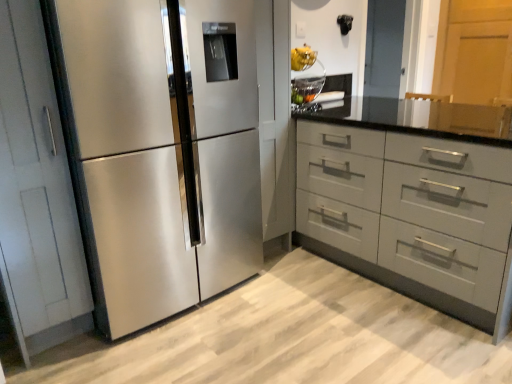
The image size is (512, 384). Describe the element at coordinates (164, 150) in the screenshot. I see `stainless steel refrigerator at left` at that location.

The width and height of the screenshot is (512, 384). Identify the location of stainless steel refrigerator at left. (164, 150).

Measure the distance between matte gray drawers at center-right and camera.

5.29 feet.

What is the approximate width of matte gray drawers at center-right?

91.04 centimeters.

Locate an element on the screen. This screenshot has width=512, height=384. matte gray drawers at center-right is located at coordinates (409, 213).

Describe the element at coordinates (409, 213) in the screenshot. I see `matte gray drawers at center-right` at that location.

Find the location of a particular element. stainless steel refrigerator at left is located at coordinates (164, 150).

Between matte gray drawers at center-right and stainless steel refrigerator at left, which one appears on the left side from the viewer's perspective?

Positioned to the left is stainless steel refrigerator at left.

Looking at this image, does matte gray drawers at center-right lie in front of stainless steel refrigerator at left?

No, it is not.

Is point (461, 248) positioned in front of point (256, 91)?

Yes, it is.

From the image's perspective, is matte gray drawers at center-right located above or below stainless steel refrigerator at left?

matte gray drawers at center-right is situated lower than stainless steel refrigerator at left in the image.

From a real-world perspective, is matte gray drawers at center-right physically above stainless steel refrigerator at left?

No, from a real-world perspective, matte gray drawers at center-right is not above stainless steel refrigerator at left.

Consider the image. Looking at their sizes, would you say matte gray drawers at center-right is wider or thinner than stainless steel refrigerator at left?

In the image, matte gray drawers at center-right appears to be wider than stainless steel refrigerator at left.

Which of these two, matte gray drawers at center-right or stainless steel refrigerator at left, stands shorter?

matte gray drawers at center-right.

Does matte gray drawers at center-right have a larger size compared to stainless steel refrigerator at left?

Correct, matte gray drawers at center-right is larger in size than stainless steel refrigerator at left.

Based on the photo, choose the correct answer: Is matte gray drawers at center-right inside stainless steel refrigerator at left or outside it?

The correct answer is: outside.

Are matte gray drawers at center-right and stainless steel refrigerator at left making contact?

No, matte gray drawers at center-right is not touching stainless steel refrigerator at left.

Is matte gray drawers at center-right looking in the opposite direction of stainless steel refrigerator at left?

That's not correct — matte gray drawers at center-right is not looking away from stainless steel refrigerator at left.

Find the location of a particular element. Image resolution: width=512 pixels, height=384 pixels. the chest of drawers below the stainless steel refrigerator at left (from the image's perspective) is located at coordinates (409, 213).

Is stainless steel refrigerator at left at the left side of matte gray drawers at center-right?

Indeed, stainless steel refrigerator at left is positioned on the left side of matte gray drawers at center-right.

Is stainless steel refrigerator at left further to the viewer compared to matte gray drawers at center-right?

No, stainless steel refrigerator at left is closer to the viewer.

Which is closer, (146,232) or (378,203)?

The point (146,232) is in front.

From the image's perspective, is stainless steel refrigerator at left positioned above or below matte gray drawers at center-right?

Clearly, from the image's perspective, stainless steel refrigerator at left is above matte gray drawers at center-right.

From a real-world perspective, is stainless steel refrigerator at left positioned above or below matte gray drawers at center-right?

stainless steel refrigerator at left is situated higher than matte gray drawers at center-right in the real world.

Does stainless steel refrigerator at left have a greater width compared to matte gray drawers at center-right?

In fact, stainless steel refrigerator at left might be narrower than matte gray drawers at center-right.

Which of these two, stainless steel refrigerator at left or matte gray drawers at center-right, stands taller?

stainless steel refrigerator at left is taller.

Can you confirm if stainless steel refrigerator at left is bigger than matte gray drawers at center-right?

No, stainless steel refrigerator at left is not bigger than matte gray drawers at center-right.

Is stainless steel refrigerator at left not inside matte gray drawers at center-right?

Yes, stainless steel refrigerator at left is outside of matte gray drawers at center-right.

Are stainless steel refrigerator at left and matte gray drawers at center-right far apart?

No, stainless steel refrigerator at left is in close proximity to matte gray drawers at center-right.

Could you tell me if stainless steel refrigerator at left is turned towards matte gray drawers at center-right?

No, stainless steel refrigerator at left is not turned towards matte gray drawers at center-right.

I want to click on refrigerator on the left of matte gray drawers at center-right, so click(x=164, y=150).

Locate an element on the screen. refrigerator that is above the matte gray drawers at center-right (from the image's perspective) is located at coordinates (164, 150).

Image resolution: width=512 pixels, height=384 pixels. I want to click on chest of drawers below the stainless steel refrigerator at left (from the image's perspective), so click(409, 213).